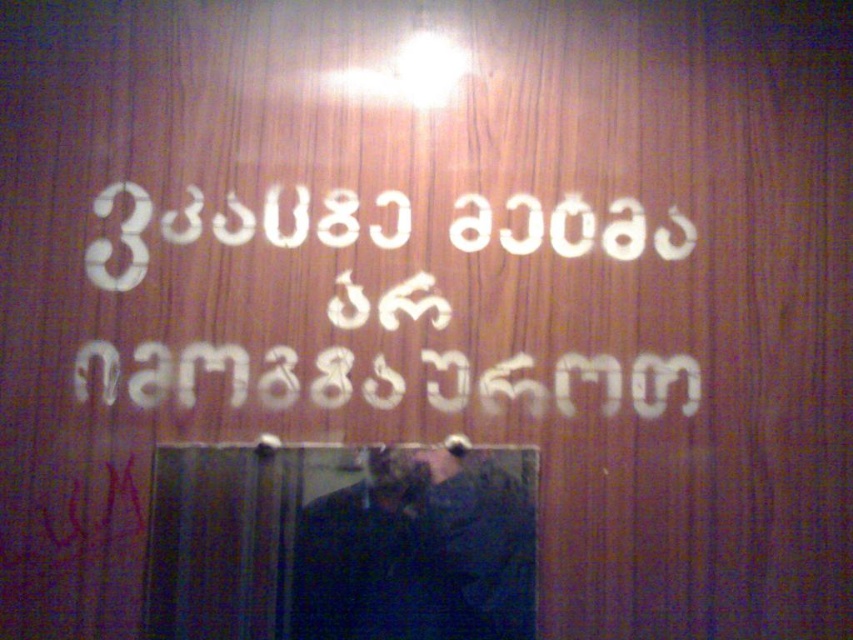
Question: Is white plastic sign at center wider than dark fabric man at center?

Choices:
 (A) no
 (B) yes

Answer: (B)

Question: Which of the following is the farthest from the observer?

Choices:
 (A) [x=294, y=364]
 (B) [x=518, y=618]

Answer: (A)

Question: Which object is farther from the camera taking this photo?

Choices:
 (A) white plastic sign at center
 (B) dark fabric man at center

Answer: (A)

Question: Does white plastic sign at center have a smaller size compared to dark fabric man at center?

Choices:
 (A) no
 (B) yes

Answer: (A)

Question: Does white plastic sign at center have a smaller size compared to dark fabric man at center?

Choices:
 (A) no
 (B) yes

Answer: (A)